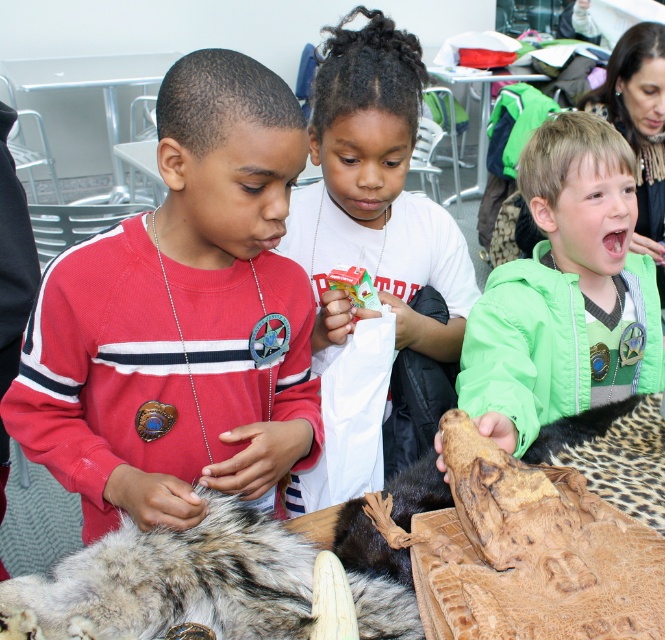
I want to click on green fabric jacket at center, so click(x=563, y=291).

Can you confirm if green fabric jacket at center is positioned above white matte paper bag at center?

No, green fabric jacket at center is not above white matte paper bag at center.

Is point (557, 388) positioned in front of point (414, 124)?

Yes, it is in front of point (414, 124).

Identify the location of green fabric jacket at center. This screenshot has height=640, width=665. (563, 291).

Does red sweater at center have a larger size compared to green fabric jacket at center?

Incorrect, red sweater at center is not larger than green fabric jacket at center.

Who is more distant from viewer, (196, 80) or (587, 234)?

The point (587, 234) is more distant.

Is point (207, 449) positioned in front of point (648, 326)?

Yes, point (207, 449) is in front of point (648, 326).

Locate an element on the screen. Image resolution: width=665 pixels, height=640 pixels. red sweater at center is located at coordinates (180, 317).

Does red sweater at center have a smaller size compared to fuzzy fur pelt at lower left?

Actually, red sweater at center might be larger than fuzzy fur pelt at lower left.

Between red sweater at center and fuzzy fur pelt at lower left, which one has less height?

With less height is fuzzy fur pelt at lower left.

Identify the location of red sweater at center. (180, 317).